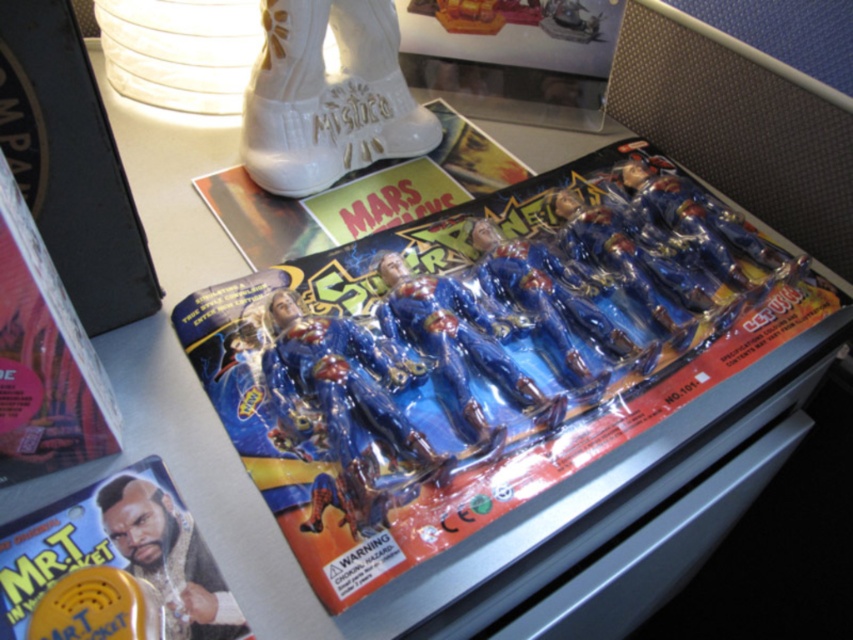
Does blue plastic comic book at center have a lesser width compared to matte plastic comic book at lower left?

In fact, blue plastic comic book at center might be wider than matte plastic comic book at lower left.

Can you confirm if blue plastic comic book at center is taller than matte plastic comic book at lower left?

Correct, blue plastic comic book at center is much taller as matte plastic comic book at lower left.

Where is `blue plastic comic book at center`? blue plastic comic book at center is located at coordinates coord(483,355).

Locate an element on the screen. blue plastic comic book at center is located at coordinates (483, 355).